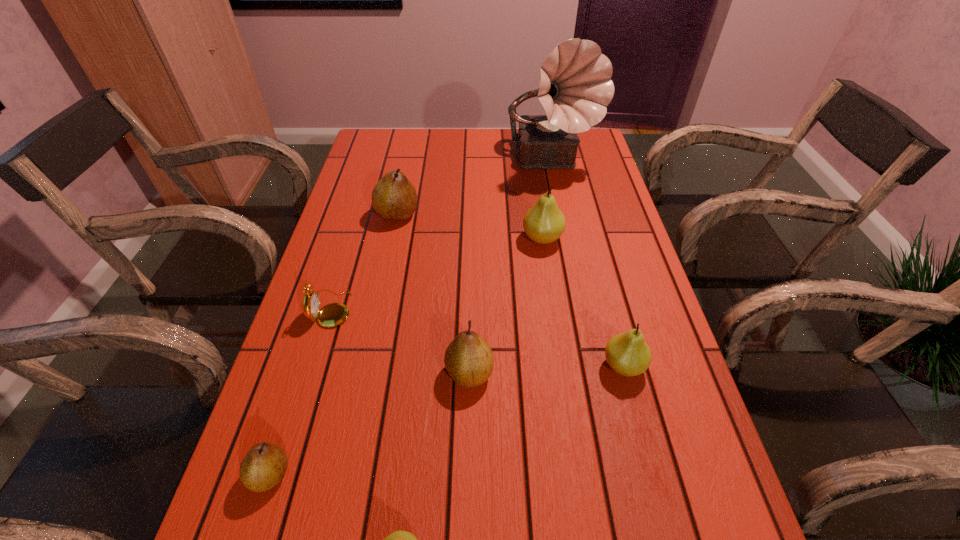
The width and height of the screenshot is (960, 540). I want to click on pocket watch, so click(x=334, y=314).

Where is `the smallest brown pear`? the smallest brown pear is located at coordinates (264, 466).

Where is `the second nearest pear`? The width and height of the screenshot is (960, 540). the second nearest pear is located at coordinates (264, 466).

This screenshot has height=540, width=960. I want to click on free space located from the horn of the record player, so 570,250.

You are a GUI agent. You are given a task and a screenshot of the screen. Output one action in this format:
    pyautogui.click(x=<x>, y=<y>)
    Task: Click on the vacant point located 0.140m on the right of the farthest green pear
    This screenshot has width=960, height=540.
    Given the screenshot: What is the action you would take?
    pyautogui.click(x=615, y=239)

The width and height of the screenshot is (960, 540). I want to click on blank space located on the front of the farthest brown pear, so click(x=371, y=341).

I want to click on vacant space located 0.300m on the back of the fifth object from left to right, so click(471, 255).

Locate an element on the screen. The height and width of the screenshot is (540, 960). vacant space located on the left of the second biggest green pear is located at coordinates (572, 366).

Identify the location of vacant space located on the face of the pocket watch. The image size is (960, 540). (420, 308).

Locate an element on the screen. vacant space located on the right of the leftmost brown pear is located at coordinates (332, 474).